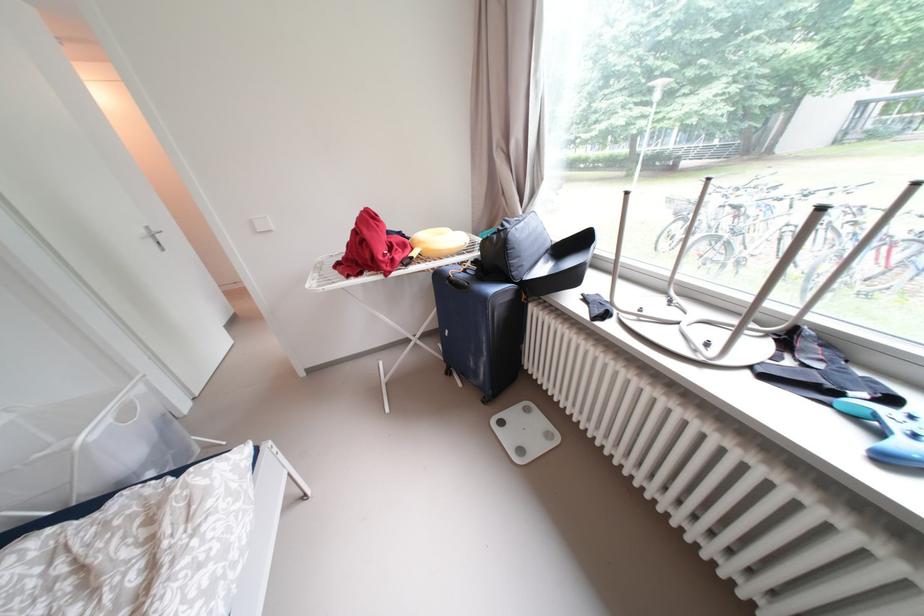
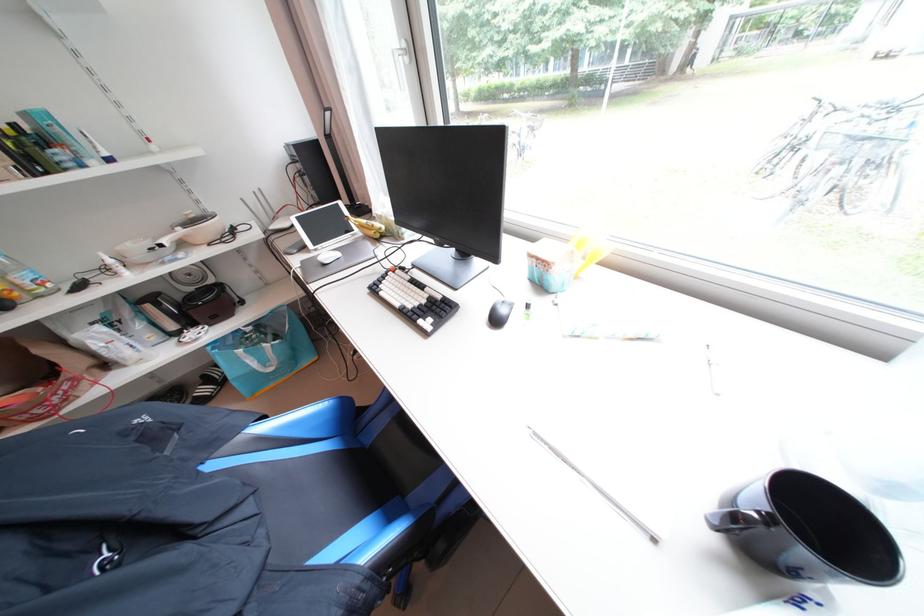
The images are taken continuously from a first-person perspective. In which direction are you moving?

The movement direction of the cameraman is left, forward.